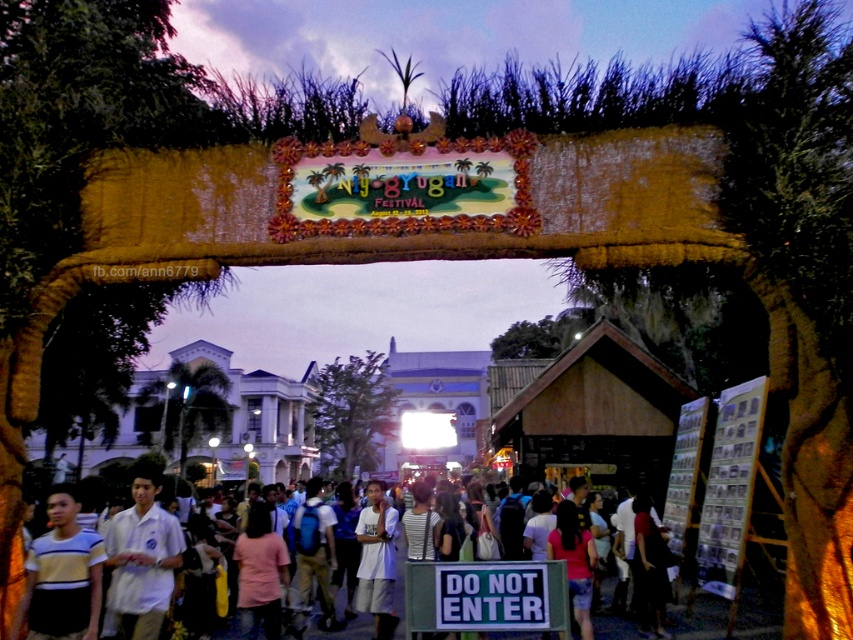
You are standing at the entrance of the Ayogayugan Festival and want to take a photo of two specific points marked in the image. The first point is at coordinates point (51, 592) and the second is at point (152, 621). Which point will appear larger in your photo?

Point (51, 592) is closer to the camera than point (152, 621), so it will appear larger in the photo.

You are at the Ayogayugan Festival entrance and notice a person wearing a white matte shirt at lower left. Can you tell me the exact coordinates where this person is located?

The white matte shirt at lower left is located at point (142,556).